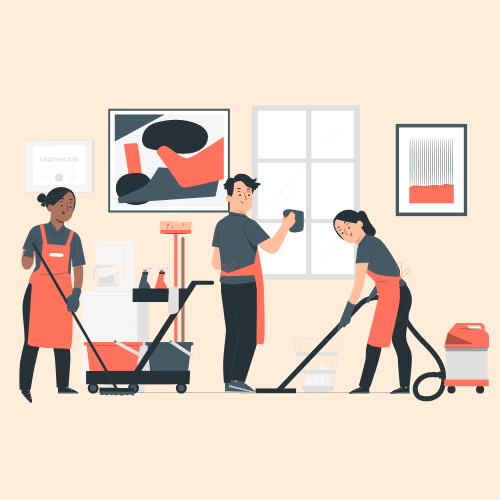
This screenshot has height=500, width=500. Find the location of `window`. window is located at coordinates (336, 185).